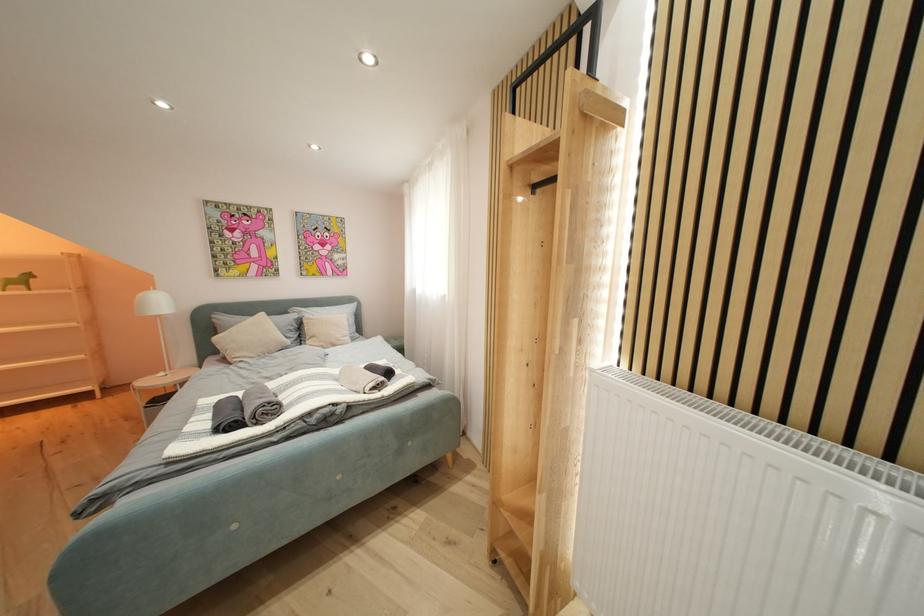
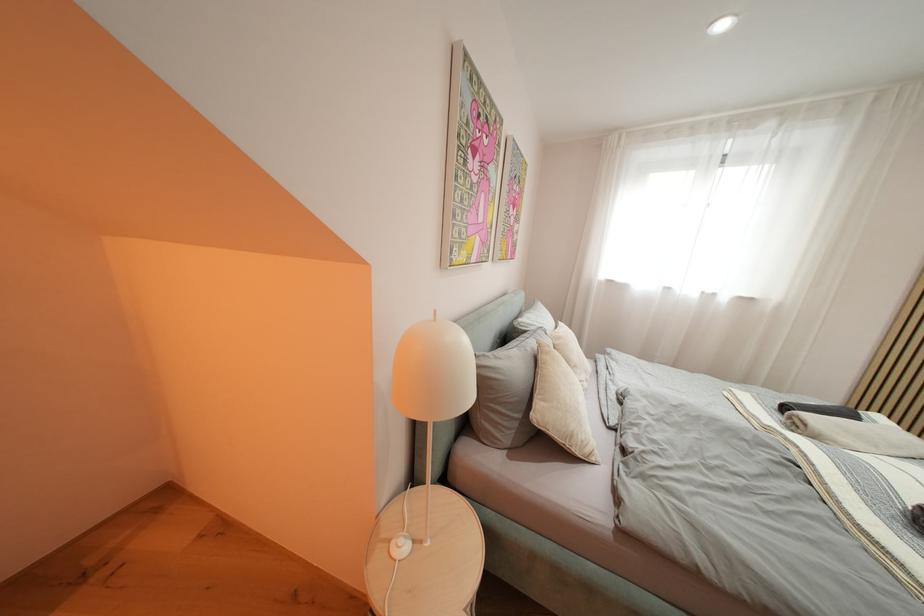
Which direction would the cameraman need to move to produce the second image?

The cameraman walked toward left, forward.